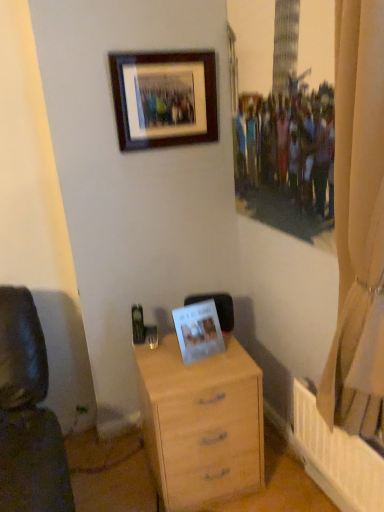
Question: Which is correct: beige fabric curtain at right is inside white paper photo frame at center, acting as the 1th picture frame starting from the bottom, or outside of it?

Choices:
 (A) outside
 (B) inside

Answer: (A)

Question: Is beige fabric curtain at right wider or thinner than white paper photo frame at center, acting as the 1th picture frame starting from the bottom?

Choices:
 (A) thin
 (B) wide

Answer: (B)

Question: Estimate the real-world distances between objects in this image. Which object is farther from the white paper photo frame at center, marked as the second picture frame in a top-to-bottom arrangement?

Choices:
 (A) wooden frame at upper center, the first picture frame when ordered from top to bottom
 (B) beige fabric curtain at right
 (C) light wood chest of drawers at center

Answer: (A)

Question: Based on their relative distances, which object is nearer to the white paper photo frame at center, marked as the second picture frame in a top-to-bottom arrangement?

Choices:
 (A) beige fabric curtain at right
 (B) light wood chest of drawers at center
 (C) wooden frame at upper center, arranged as the second picture frame when ordered from the bottom

Answer: (B)